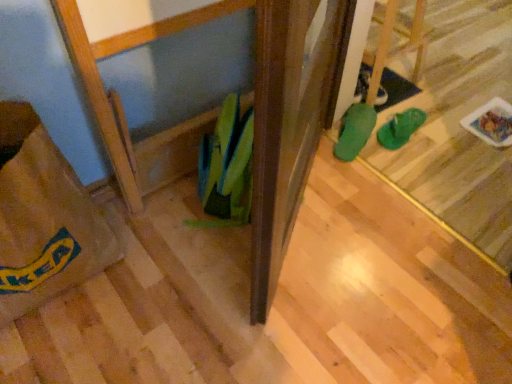
What do you see at coordinates (354, 131) in the screenshot?
I see `green rubber boot at center, marked as the second footwear in a right-to-left arrangement` at bounding box center [354, 131].

How much space does green rubber boot at center, marked as the second footwear in a right-to-left arrangement, occupy vertically?

The height of green rubber boot at center, marked as the second footwear in a right-to-left arrangement, is 3.62 inches.

Describe the element at coordinates (400, 128) in the screenshot. I see `green rubber flip-flops at center, the first footwear in the right-to-left sequence` at that location.

Describe the element at coordinates (48, 228) in the screenshot. Image resolution: width=512 pixels, height=384 pixels. I see `brown paper bag at lower left` at that location.

This screenshot has height=384, width=512. I want to click on green rubber boot at center, placed as the first footwear when sorted from left to right, so click(354, 131).

In the scene shown: Is green rubber boot at center, placed as the first footwear when sorted from left to right, positioned before brown paper bag at lower left?

No, green rubber boot at center, placed as the first footwear when sorted from left to right, is further to the viewer.

In the scene shown: Is brown paper bag at lower left located within green rubber boot at center, placed as the first footwear when sorted from left to right?

No, brown paper bag at lower left is not a part of green rubber boot at center, placed as the first footwear when sorted from left to right.

At what (x,y) coordinates should I click in order to perform the action: click on footwear that is the 1st object located behind the brown paper bag at lower left. Please return your answer as a coordinate pair (x, y). Looking at the image, I should click on (354, 131).

Looking at this image, from the image's perspective, which object appears higher, green rubber boot at center, placed as the first footwear when sorted from left to right, or brown paper bag at lower left?

green rubber boot at center, placed as the first footwear when sorted from left to right, from the image's perspective.

Is green rubber boot at center, placed as the first footwear when sorted from left to right, positioned beyond the bounds of green rubber flip-flops at center, the first footwear in the right-to-left sequence?

Yes, green rubber boot at center, placed as the first footwear when sorted from left to right, is outside of green rubber flip-flops at center, the first footwear in the right-to-left sequence.

Which of these two, green rubber boot at center, placed as the first footwear when sorted from left to right, or green rubber flip-flops at center, the second footwear when ordered from left to right, is wider?

green rubber boot at center, placed as the first footwear when sorted from left to right, is wider.

Is green rubber boot at center, placed as the first footwear when sorted from left to right, turned away from green rubber flip-flops at center, the second footwear when ordered from left to right?

No, green rubber boot at center, placed as the first footwear when sorted from left to right, is not facing away from green rubber flip-flops at center, the second footwear when ordered from left to right.

Does point (37, 208) appear closer or farther from the camera than point (391, 144)?

Point (37, 208).

Is brown paper bag at lower left positioned with its back to green rubber flip-flops at center, the second footwear when ordered from left to right?

No, brown paper bag at lower left's orientation is not away from green rubber flip-flops at center, the second footwear when ordered from left to right.

Considering the relative sizes of brown paper bag at lower left and green rubber flip-flops at center, the second footwear when ordered from left to right, in the image provided, is brown paper bag at lower left thinner than green rubber flip-flops at center, the second footwear when ordered from left to right,?

No, brown paper bag at lower left is not thinner than green rubber flip-flops at center, the second footwear when ordered from left to right.

Is green rubber flip-flops at center, the first footwear in the right-to-left sequence, aimed at green rubber boot at center, marked as the second footwear in a right-to-left arrangement?

No, green rubber flip-flops at center, the first footwear in the right-to-left sequence, is not turned towards green rubber boot at center, marked as the second footwear in a right-to-left arrangement.

From a real-world perspective, is green rubber flip-flops at center, the second footwear when ordered from left to right, physically located above or below green rubber boot at center, placed as the first footwear when sorted from left to right?

green rubber flip-flops at center, the second footwear when ordered from left to right, is situated lower than green rubber boot at center, placed as the first footwear when sorted from left to right, in the real world.

Is green rubber boot at center, placed as the first footwear when sorted from left to right, inside green rubber flip-flops at center, the second footwear when ordered from left to right?

No, green rubber boot at center, placed as the first footwear when sorted from left to right, is not inside green rubber flip-flops at center, the second footwear when ordered from left to right.

Considering the relative positions of green rubber flip-flops at center, the second footwear when ordered from left to right, and green rubber boot at center, placed as the first footwear when sorted from left to right, in the image provided, is green rubber flip-flops at center, the second footwear when ordered from left to right, to the left or to the right of green rubber boot at center, placed as the first footwear when sorted from left to right,?

In the image, green rubber flip-flops at center, the second footwear when ordered from left to right, appears on the right side of green rubber boot at center, placed as the first footwear when sorted from left to right.

Does point (398, 137) come behind point (82, 255)?

Yes.

Where is `grocery bag located in front of the green rubber flip-flops at center, the second footwear when ordered from left to right`? This screenshot has width=512, height=384. grocery bag located in front of the green rubber flip-flops at center, the second footwear when ordered from left to right is located at coordinates (48, 228).

From the image's perspective, between green rubber flip-flops at center, the first footwear in the right-to-left sequence, and brown paper bag at lower left, which one is located above?

green rubber flip-flops at center, the first footwear in the right-to-left sequence, from the image's perspective.

Does green rubber flip-flops at center, the first footwear in the right-to-left sequence, have a smaller size compared to brown paper bag at lower left?

Correct, green rubber flip-flops at center, the first footwear in the right-to-left sequence, occupies less space than brown paper bag at lower left.

Which is more to the right, brown paper bag at lower left or green rubber boot at center, placed as the first footwear when sorted from left to right?

green rubber boot at center, placed as the first footwear when sorted from left to right, is more to the right.

From the picture: Does brown paper bag at lower left come in front of green rubber boot at center, placed as the first footwear when sorted from left to right?

Yes, it is in front of green rubber boot at center, placed as the first footwear when sorted from left to right.

How different are the orientations of brown paper bag at lower left and green rubber boot at center, placed as the first footwear when sorted from left to right, in degrees?

The angular difference between brown paper bag at lower left and green rubber boot at center, placed as the first footwear when sorted from left to right, is 116 degrees.

Considering the sizes of brown paper bag at lower left and green rubber boot at center, marked as the second footwear in a right-to-left arrangement, in the image, is brown paper bag at lower left wider or thinner than green rubber boot at center, marked as the second footwear in a right-to-left arrangement,?

In the image, brown paper bag at lower left appears to be wider than green rubber boot at center, marked as the second footwear in a right-to-left arrangement.

The width and height of the screenshot is (512, 384). There is a green rubber boot at center, placed as the first footwear when sorted from left to right. Find the location of `grocery bag above it (from a real-world perspective)`. grocery bag above it (from a real-world perspective) is located at coordinates (48, 228).

This screenshot has height=384, width=512. I want to click on footwear behind the green rubber boot at center, marked as the second footwear in a right-to-left arrangement, so click(x=400, y=128).

From the image, which object appears to be farther from brown paper bag at lower left, green rubber flip-flops at center, the second footwear when ordered from left to right, or green rubber boot at center, placed as the first footwear when sorted from left to right?

The object further to brown paper bag at lower left is green rubber flip-flops at center, the second footwear when ordered from left to right.

Looking at the image, which one is located closer to green rubber flip-flops at center, the second footwear when ordered from left to right, brown paper bag at lower left or green rubber boot at center, placed as the first footwear when sorted from left to right?

green rubber boot at center, placed as the first footwear when sorted from left to right, lies closer to green rubber flip-flops at center, the second footwear when ordered from left to right, than the other object.

Considering their positions, is brown paper bag at lower left positioned further to green rubber boot at center, placed as the first footwear when sorted from left to right, than green rubber flip-flops at center, the first footwear in the right-to-left sequence?

brown paper bag at lower left is further to green rubber boot at center, placed as the first footwear when sorted from left to right.

Which object lies further to the anchor point green rubber flip-flops at center, the first footwear in the right-to-left sequence, green rubber boot at center, placed as the first footwear when sorted from left to right, or brown paper bag at lower left?

brown paper bag at lower left is positioned further to the anchor green rubber flip-flops at center, the first footwear in the right-to-left sequence.

When comparing their distances from green rubber boot at center, placed as the first footwear when sorted from left to right, does green rubber flip-flops at center, the first footwear in the right-to-left sequence, or brown paper bag at lower left seem closer?

Based on the image, green rubber flip-flops at center, the first footwear in the right-to-left sequence, appears to be nearer to green rubber boot at center, placed as the first footwear when sorted from left to right.

Which object lies further to the anchor point brown paper bag at lower left, green rubber boot at center, placed as the first footwear when sorted from left to right, or green rubber flip-flops at center, the first footwear in the right-to-left sequence?

The object further to brown paper bag at lower left is green rubber flip-flops at center, the first footwear in the right-to-left sequence.

I want to click on footwear between brown paper bag at lower left and green rubber flip-flops at center, the second footwear when ordered from left to right, so [x=354, y=131].